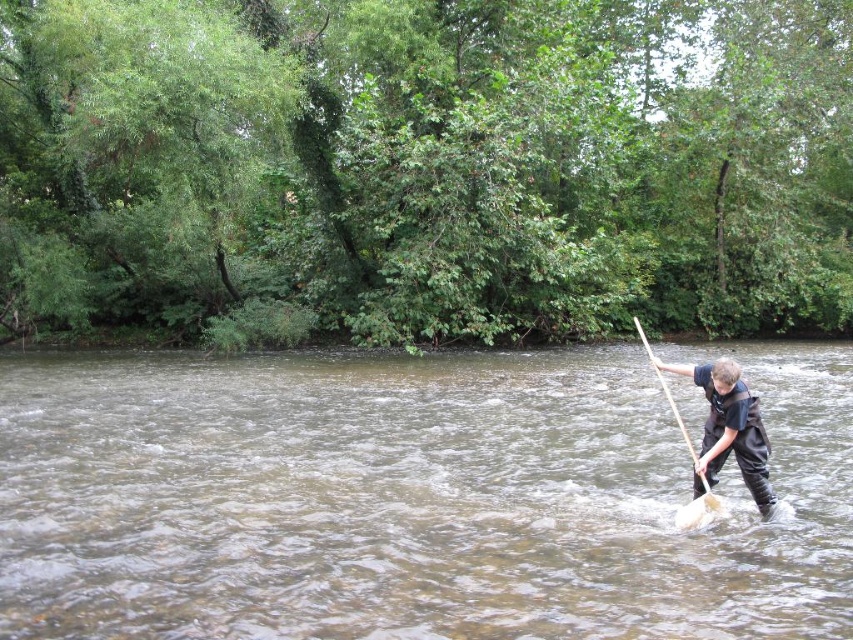
Which is above, brown muddy water at center or wooden paddle at right?

wooden paddle at right is above.

Between point (799, 493) and point (691, 513), which one is positioned in front?

Point (691, 513) is more forward.

The width and height of the screenshot is (853, 640). In order to click on brown muddy water at center in this screenshot , I will do `click(409, 499)`.

What do you see at coordinates (729, 429) in the screenshot? Image resolution: width=853 pixels, height=640 pixels. I see `dark blue fabric at right` at bounding box center [729, 429].

From the picture: Which is more to the left, dark blue fabric at right or wooden paddle at right?

dark blue fabric at right

You are a GUI agent. You are given a task and a screenshot of the screen. Output one action in this format:
    pyautogui.click(x=<x>, y=<y>)
    Task: Click on the dark blue fabric at right
    The height and width of the screenshot is (640, 853).
    Given the screenshot: What is the action you would take?
    tap(729, 429)

Based on the photo, is brown muddy water at center to the left of dark blue fabric at right from the viewer's perspective?

Correct, you'll find brown muddy water at center to the left of dark blue fabric at right.

Between brown muddy water at center and dark blue fabric at right, which one appears on the left side from the viewer's perspective?

brown muddy water at center is more to the left.

Who is more forward, (113, 568) or (747, 392)?

Point (113, 568) is in front.

This screenshot has width=853, height=640. I want to click on brown muddy water at center, so click(x=409, y=499).